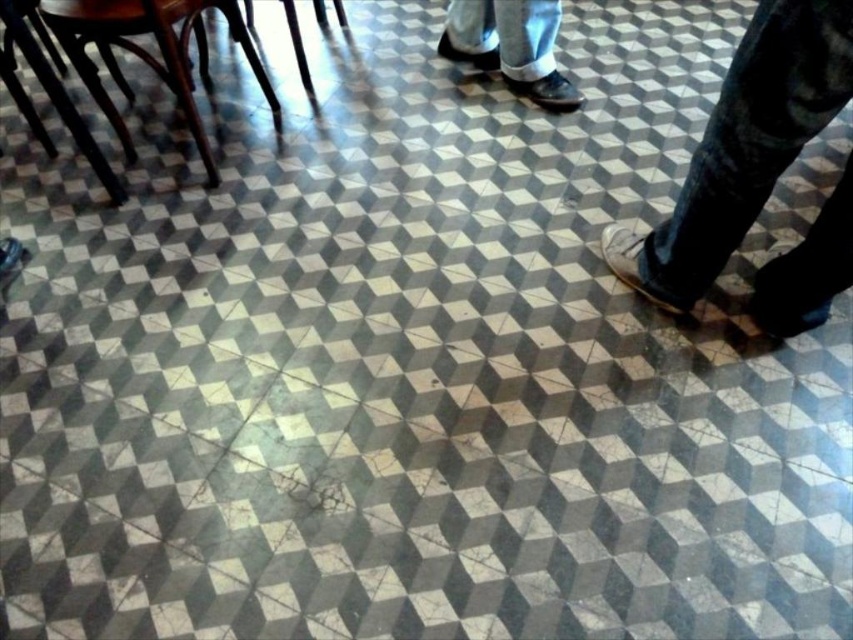
Question: Among these objects, which one is farthest from the camera?

Choices:
 (A) brown leather shoe at lower right
 (B) matte black shoe at upper center

Answer: (B)

Question: Can you confirm if brown leather shoe at lower right is positioned to the left of matte black shoe at upper center?

Choices:
 (A) no
 (B) yes

Answer: (A)

Question: Which point appears closest to the camera in this image?

Choices:
 (A) (515, 49)
 (B) (799, 269)

Answer: (B)

Question: Is brown leather shoe at lower right thinner than matte black shoe at upper center?

Choices:
 (A) yes
 (B) no

Answer: (B)

Question: Considering the relative positions of brown leather shoe at lower right and matte black shoe at upper center in the image provided, where is brown leather shoe at lower right located with respect to matte black shoe at upper center?

Choices:
 (A) above
 (B) below

Answer: (B)

Question: Which point appears farthest from the camera in this image?

Choices:
 (A) (788, 160)
 (B) (480, 49)

Answer: (B)